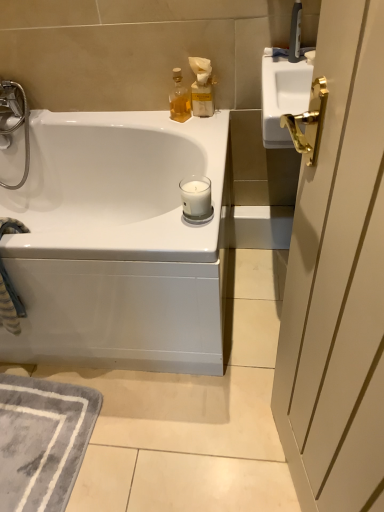
Where is `vacant space in gray soft rug at lower left (from a real-world perspective)`? vacant space in gray soft rug at lower left (from a real-world perspective) is located at coordinates (57, 448).